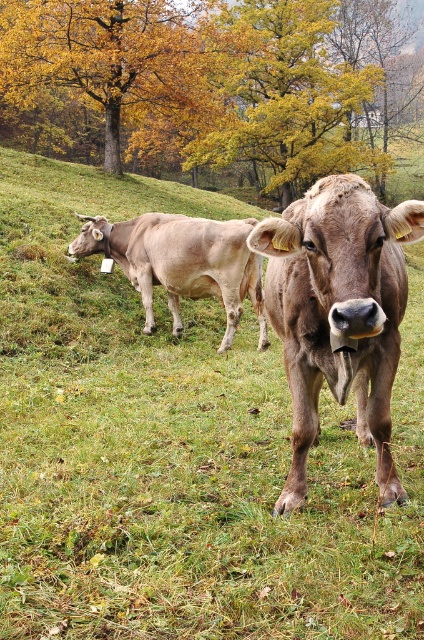
Looking at this image, can you confirm if golden leafy tree at upper center is thinner than yellow leafy tree at upper center?

Incorrect, golden leafy tree at upper center's width is not less than yellow leafy tree at upper center's.

Is golden leafy tree at upper center below yellow leafy tree at upper center?

Actually, golden leafy tree at upper center is above yellow leafy tree at upper center.

The height and width of the screenshot is (640, 424). I want to click on golden leafy tree at upper center, so (x=215, y=90).

Which of these two, brown matte cow at center or smooth brown cow at left, stands taller?

smooth brown cow at left is taller.

Measure the distance between brown matte cow at center and smooth brown cow at left.

brown matte cow at center is 12.59 feet from smooth brown cow at left.

Describe the element at coordinates (339, 312) in the screenshot. I see `brown matte cow at center` at that location.

This screenshot has height=640, width=424. Identify the location of brown matte cow at center. (x=339, y=312).

Who is lower down, golden leafy tree at upper center or brown matte cow at center?

Positioned lower is brown matte cow at center.

Is golden leafy tree at upper center below brown matte cow at center?

No, golden leafy tree at upper center is not below brown matte cow at center.

Locate an element on the screen. The width and height of the screenshot is (424, 640). golden leafy tree at upper center is located at coordinates (215, 90).